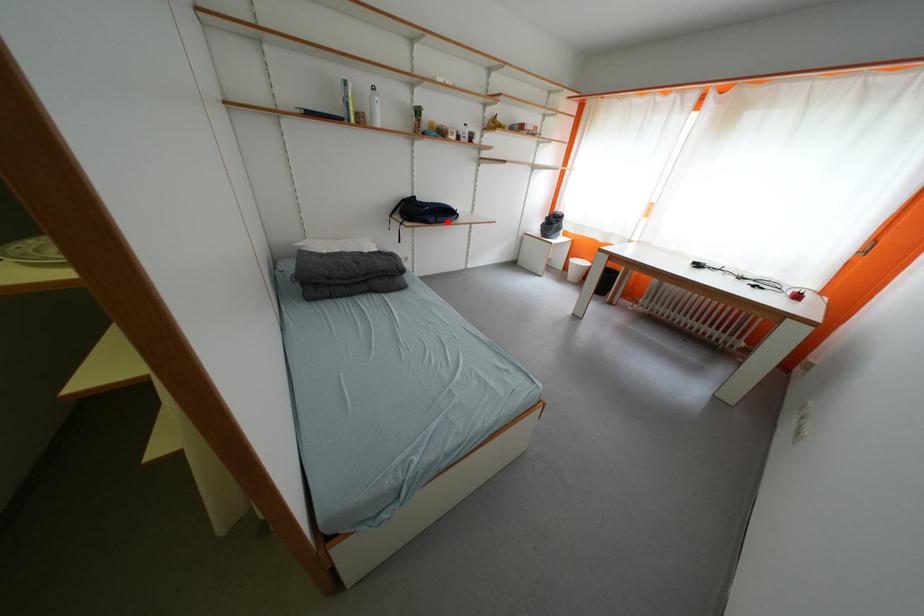
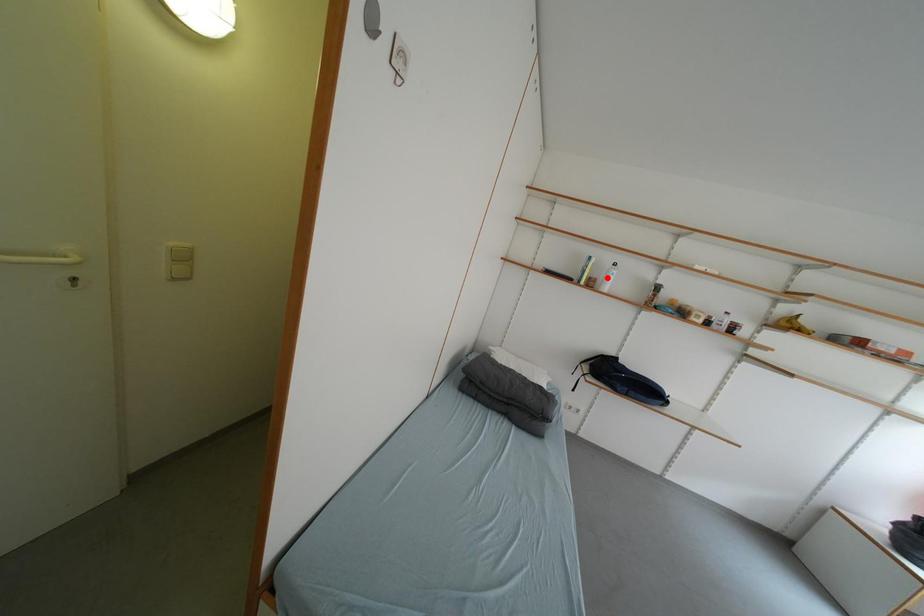
I am providing you with two images of the same scene from different viewpoints. A red point is marked on the first image and another point is marked on the second image. Do the highlighted points in image1 and image2 indicate the same real-world spot?

No